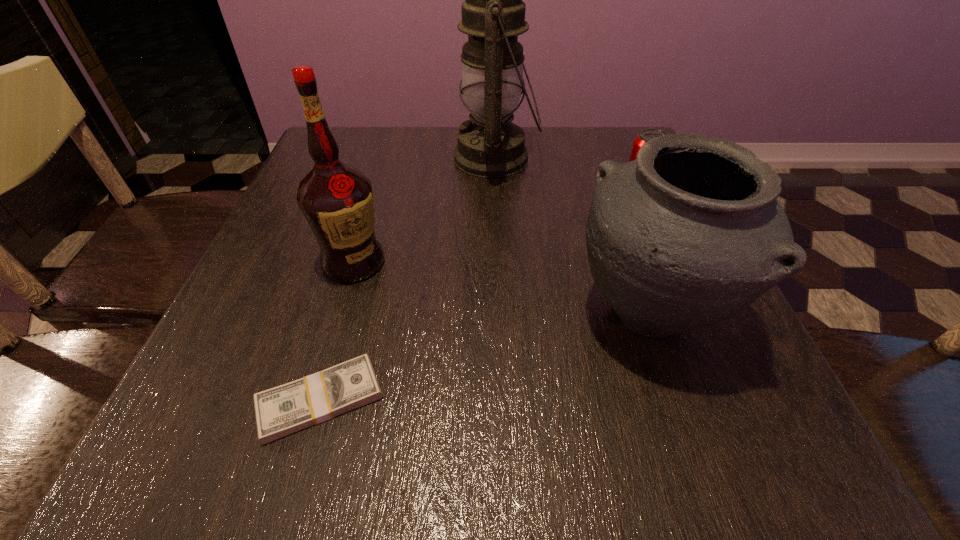
Where is `oil lamp`? oil lamp is located at coordinates (x=493, y=14).

Where is `the third object from left to right`? the third object from left to right is located at coordinates (493, 14).

You are a GUI agent. You are given a task and a screenshot of the screen. Output one action in this format:
    pyautogui.click(x=<x>, y=<y>)
    Task: Click on the second tallest object
    
    Given the screenshot: What is the action you would take?
    pyautogui.click(x=336, y=199)

Where is `urn`? urn is located at coordinates (691, 233).

Locate an element on the screen. the second shortest object is located at coordinates (645, 135).

Identify the location of dollar. (280, 411).

Locate an element on the screen. vacant space located on the left of the oil lamp is located at coordinates (311, 158).

The height and width of the screenshot is (540, 960). Identify the location of vacant position located 0.130m on the label of the alcohol. (328, 347).

The width and height of the screenshot is (960, 540). What are the coordinates of `free spot located on the left of the urn` in the screenshot? It's located at pos(415,315).

This screenshot has width=960, height=540. What are the coordinates of `vacant space situated on the back of the second shortest object` in the screenshot? It's located at (608, 130).